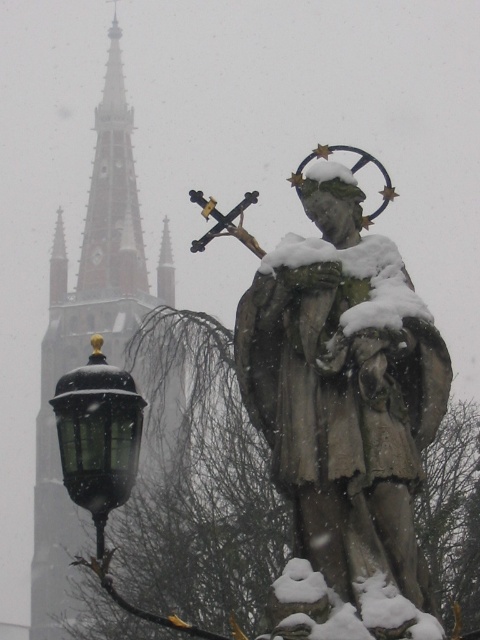
Question: Can you confirm if black glass lamp post at left is positioned to the left of smooth stone spire at upper left?

Choices:
 (A) no
 (B) yes

Answer: (A)

Question: Which of these objects is positioned closest to the smooth stone spire at upper left?

Choices:
 (A) snow-covered stone statue at center
 (B) brick steeple at upper left
 (C) black glass lamp post at left

Answer: (B)

Question: Which is nearer to the smooth stone spire at upper left?

Choices:
 (A) brick steeple at upper left
 (B) snow-covered stone statue at center

Answer: (A)

Question: Estimate the real-world distances between objects in this image. Which object is closer to the snow-covered stone statue at center?

Choices:
 (A) black glass lamp post at left
 (B) brick steeple at upper left

Answer: (A)

Question: Is snow-covered stone statue at center closer to camera compared to smooth stone spire at upper left?

Choices:
 (A) yes
 (B) no

Answer: (A)

Question: Can you confirm if snow-covered stone statue at center is smaller than brick steeple at upper left?

Choices:
 (A) no
 (B) yes

Answer: (B)